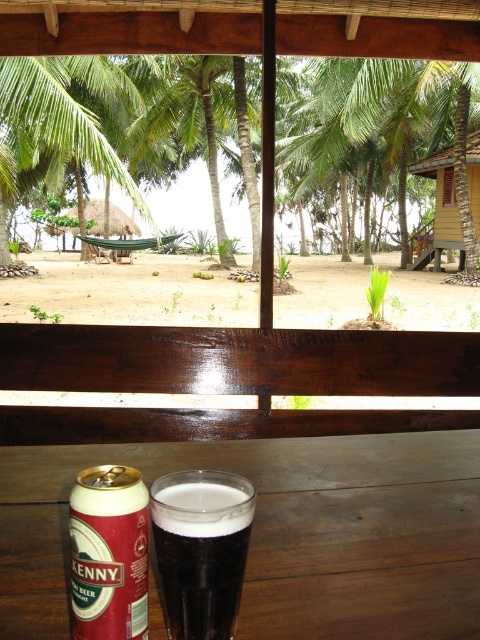
Looking at this image, you are a beachgoer sitting at the wooden table. You want to grab the red matte can at lower left but need to reach over the dark matte glass at lower center. Is the glass in your way?

The dark matte glass at lower center is below the red matte can at lower left, so the glass is not in your way when reaching for the can.

You are a photographer standing on the wooden deck. You want to take a photo of the brown sandy beach at center and the dark matte glass at lower center. Which object should you move your camera to the left to capture in the frame first?

The dark matte glass at lower center is to the left of the brown sandy beach at center, so you should move your camera to the left to capture the dark matte glass at lower center first.

You are standing on the wooden deck and want to walk to the yellow wood hut at lower right. Which direction should you head from the brown sandy beach at center?

The brown sandy beach at center is located below the yellow wood hut at lower right, so you should head upward from the brown sandy beach at center to reach the yellow wood hut at lower right.